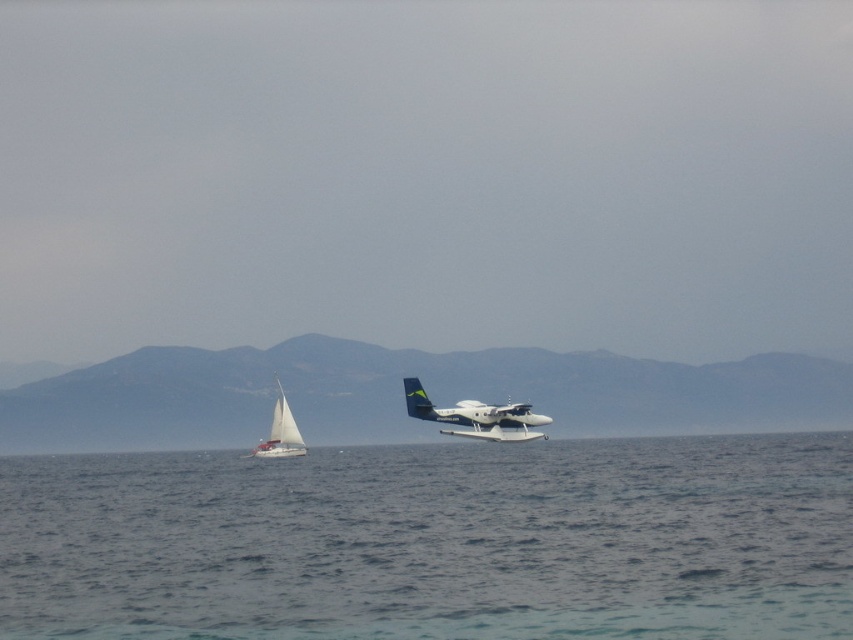
Based on the photo, you are a photographer planning to capture the entire scene of the clear blue water at center and the white glossy seaplane at center in one shot. Based on their sizes, which object will occupy more of the frame?

The clear blue water at center will occupy more of the frame because its width is larger than that of the white glossy seaplane at center.

You are a photographer planning to capture the white glossy seaplane at center and the white matte sailboat at left in a single shot. Based on their positions, which object would appear closer to the camera in the photo?

The white glossy seaplane at center appears closer to the camera because it is positioned above the white matte sailboat at left, indicating it is nearer in the scene.

You are a photographer positioned at the shore looking out at the water. You want to capture a photo where both the white glossy seaplane at center and the white matte sailboat at left are clearly visible. Based on their positions, which object will appear closer to you in the photo?

The white glossy seaplane at center will appear closer to you in the photo because it is positioned in front of the white matte sailboat at left.